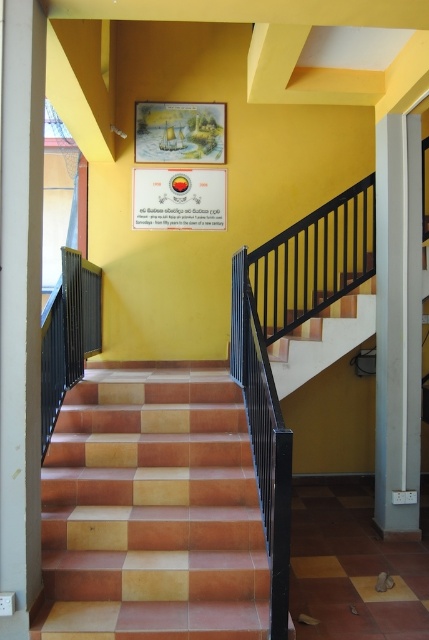
Does white smooth pillar at right have a greater height compared to matte paper sign at upper center?

Correct, white smooth pillar at right is much taller as matte paper sign at upper center.

Between point (380, 412) and point (207, 168), which one is positioned behind?

The point (207, 168) is more distant.

Between point (395, 356) and point (187, 182), which one is positioned behind?

The point (187, 182) is behind.

Locate an element on the screen. The height and width of the screenshot is (640, 429). white smooth pillar at right is located at coordinates (398, 324).

Who is higher up, terracotta tile stairs at center or white smooth pillar at left?

white smooth pillar at left

The image size is (429, 640). Identify the location of terracotta tile stairs at center. (151, 509).

Can you confirm if white smooth pillar at left is shorter than matte paper sign at upper center?

Incorrect, white smooth pillar at left's height does not fall short of matte paper sign at upper center's.

Which is more to the left, white smooth pillar at left or matte paper sign at upper center?

white smooth pillar at left is more to the left.

Measure the distance between point (14, 547) and camera.

Point (14, 547) is 3.08 meters away from camera.

The width and height of the screenshot is (429, 640). In order to click on white smooth pillar at left in this screenshot , I will do `click(21, 305)`.